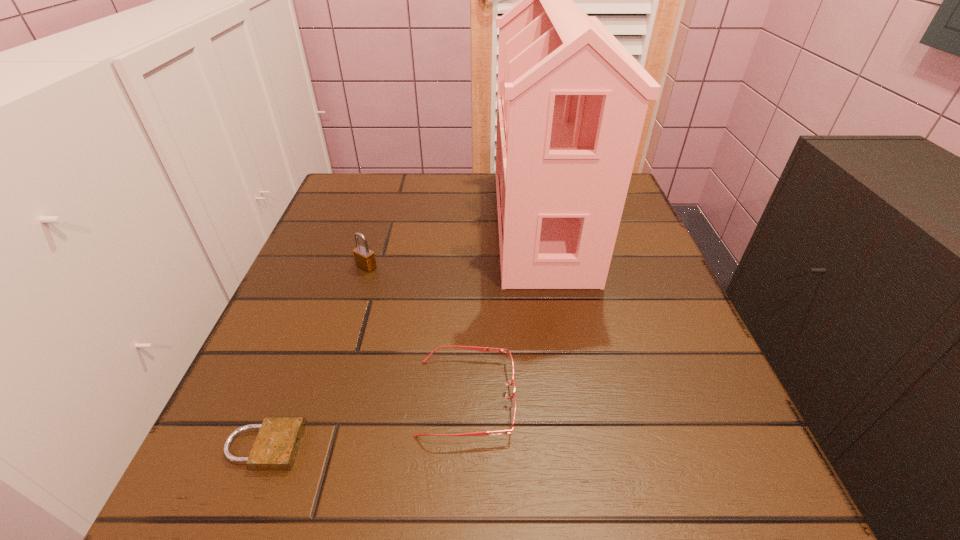
Where is `dollhouse`? The height and width of the screenshot is (540, 960). dollhouse is located at coordinates (571, 104).

Find the location of a particular element. Image resolution: width=960 pixels, height=540 pixels. the farther padlock is located at coordinates (364, 258).

Identify the location of the second tallest object. (364, 258).

Locate an element on the screen. spectacles is located at coordinates (510, 367).

This screenshot has width=960, height=540. I want to click on the nearer padlock, so click(x=275, y=448).

I want to click on the shortest object, so click(275, 448).

I want to click on vacant space situated 0.080m on the front-facing side of the dollhouse, so click(x=461, y=223).

The width and height of the screenshot is (960, 540). In order to click on vacant space located 0.130m on the front-facing side of the dollhouse in this screenshot , I will do `click(440, 223)`.

What are the coordinates of `free space located 0.340m on the front-facing side of the dollhouse` in the screenshot? It's located at (349, 223).

What are the coordinates of `vacant space located 0.080m on the back of the taller padlock` in the screenshot? It's located at (375, 238).